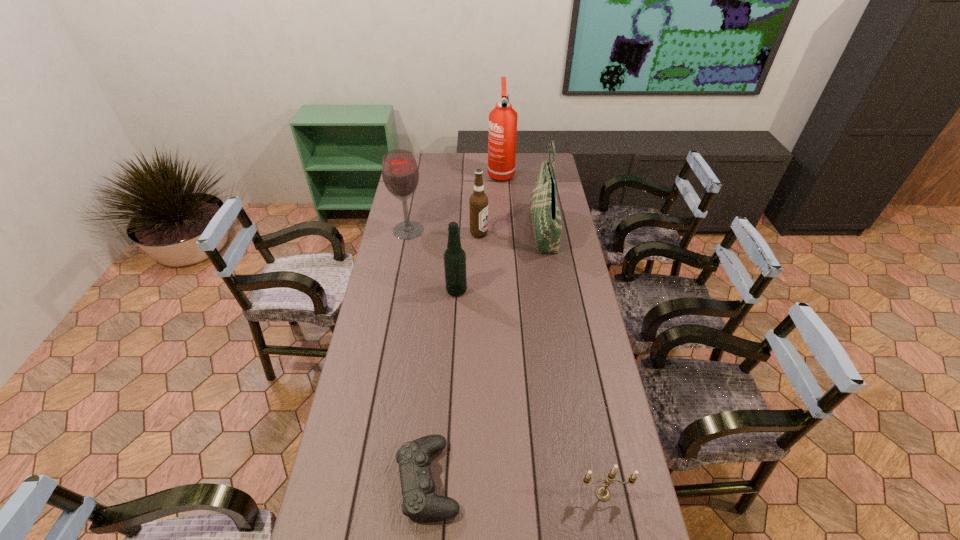
This screenshot has height=540, width=960. I want to click on object that stands as the fifth closest to the shortest object, so click(x=478, y=202).

What are the coordinates of `object identified as the fourth closest to the shortest object` in the screenshot? It's located at (400, 173).

Select which alcohol appears as the closest to the second alcohol from right to left. Please provide its 2D coordinates. Your answer should be formatted as a tuple, i.e. [(x, y)], where the tuple contains the x and y coordinates of a point satisfying the conditions above.

[(478, 202)]

Select which alcohol appears as the second closest to the leftmost alcohol. Please provide its 2D coordinates. Your answer should be formatted as a tuple, i.e. [(x, y)], where the tuple contains the x and y coordinates of a point satisfying the conditions above.

[(454, 257)]

The height and width of the screenshot is (540, 960). What are the coordinates of `vacant space that satisfies the following two spatial constraints: 1. on the front side of the sixth tallest object; 2. on the right side of the tote bag` in the screenshot? It's located at [588, 494].

Locate an element on the screen. This screenshot has width=960, height=540. free region that satisfies the following two spatial constraints: 1. at the nozzle of the fire extinguisher; 2. on the label of the rightmost alcohol is located at coordinates (505, 233).